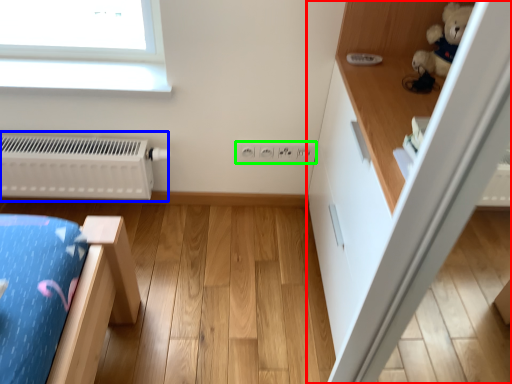
Question: Estimate the real-world distances between objects in this image. Which object is closer to dresser (highlighted by a red box), radiator (highlighted by a blue box) or electric outlet (highlighted by a green box)?

Choices:
 (A) radiator
 (B) electric outlet

Answer: (B)